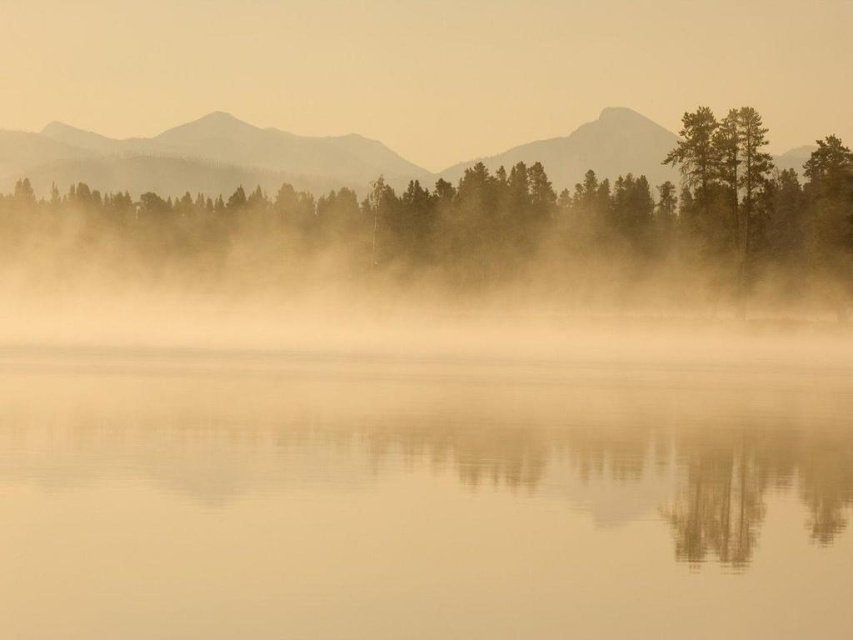
You are standing at the edge of the lake and see two points in the scene. The first point is labeled as point (105, 630) and the second is point (550, 150). Which point is closer to you?

Point (105, 630) is closer to you because it is in front of point (550, 150).

You are an observer standing at the edge of the lake. You notice the smooth water at center and the green matte tree at center. Which object is located lower in the scene?

The smooth water at center is positioned under the green matte tree at center, so it is located lower in the scene.